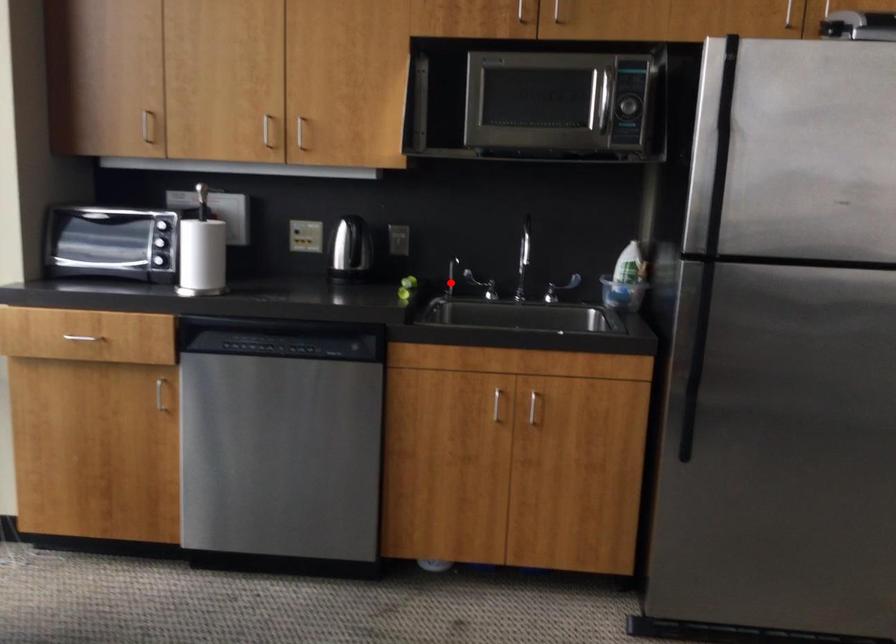
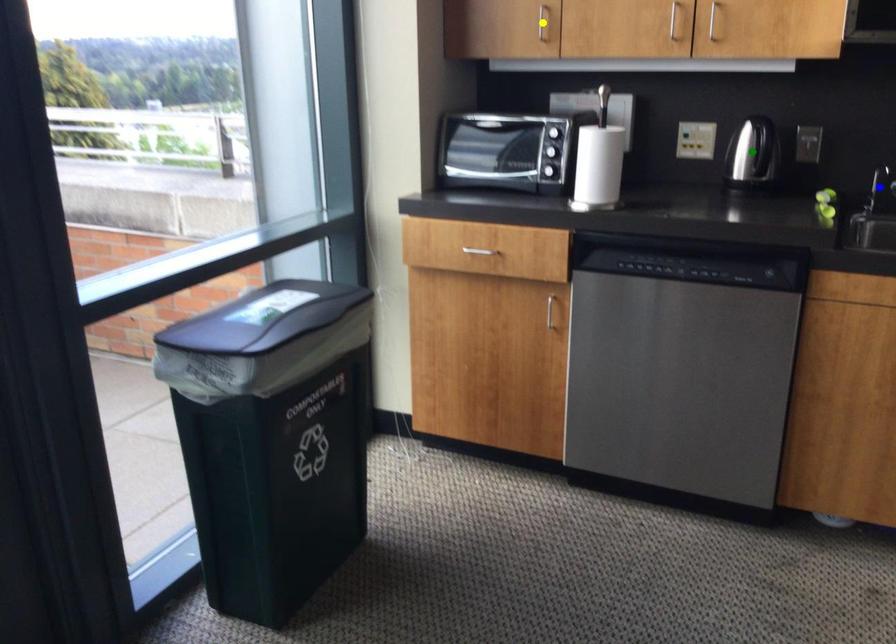
Question: I am providing you with two images of the same scene from different viewpoints. A red point is marked on the first image. You are given multiple points on the second image. Which spot in image 2 lines up with the point in image 1?

Choices:
 (A) blue point
 (B) yellow point
 (C) green point

Answer: (A)